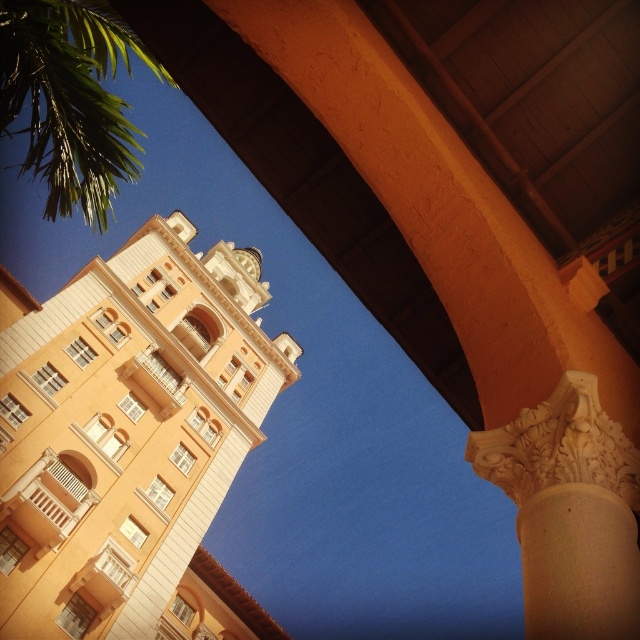
Question: Does matte orange bell tower at upper center lie in front of white carved stone column at center?

Choices:
 (A) yes
 (B) no

Answer: (B)

Question: Based on their relative distances, which object is nearer to the green leafy palm tree at upper left?

Choices:
 (A) matte orange bell tower at upper center
 (B) white carved stone column at center

Answer: (A)

Question: In this image, where is matte orange bell tower at upper center located relative to green leafy palm tree at upper left?

Choices:
 (A) left
 (B) right

Answer: (B)

Question: Does matte orange bell tower at upper center come in front of green leafy palm tree at upper left?

Choices:
 (A) yes
 (B) no

Answer: (B)

Question: Which object appears closest to the camera in this image?

Choices:
 (A) white carved stone column at center
 (B) green leafy palm tree at upper left
 (C) matte orange bell tower at upper center

Answer: (A)

Question: Which point appears closest to the camera in this image?

Choices:
 (A) (540, 572)
 (B) (122, 112)
 (C) (132, 312)

Answer: (A)